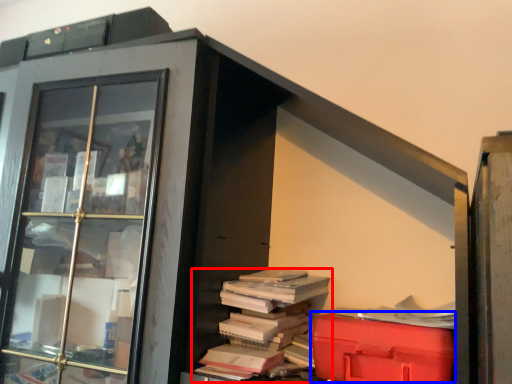
Question: Among these objects, which one is farthest to the camera, book (highlighted by a red box) or waste (highlighted by a blue box)?

Choices:
 (A) book
 (B) waste

Answer: (A)